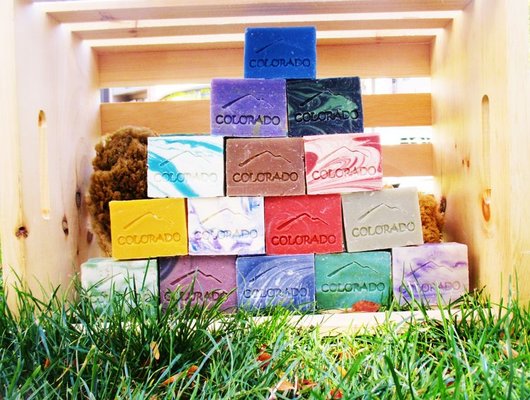
Image resolution: width=530 pixels, height=400 pixels. Find the location of `decorative soap`. decorative soap is located at coordinates 305,112.